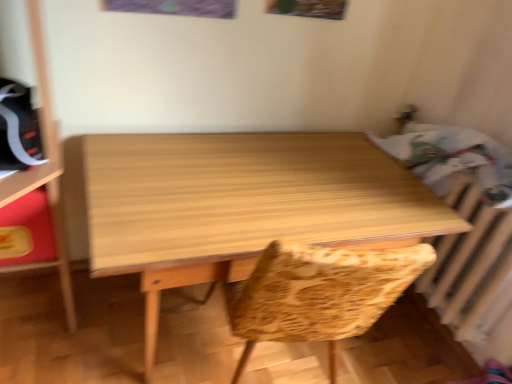
This screenshot has width=512, height=384. What do you see at coordinates (238, 203) in the screenshot?
I see `light wood table at center` at bounding box center [238, 203].

I want to click on light wood table at center, so click(x=238, y=203).

The width and height of the screenshot is (512, 384). What are the coordinates of `light wood table at center` in the screenshot? It's located at (238, 203).